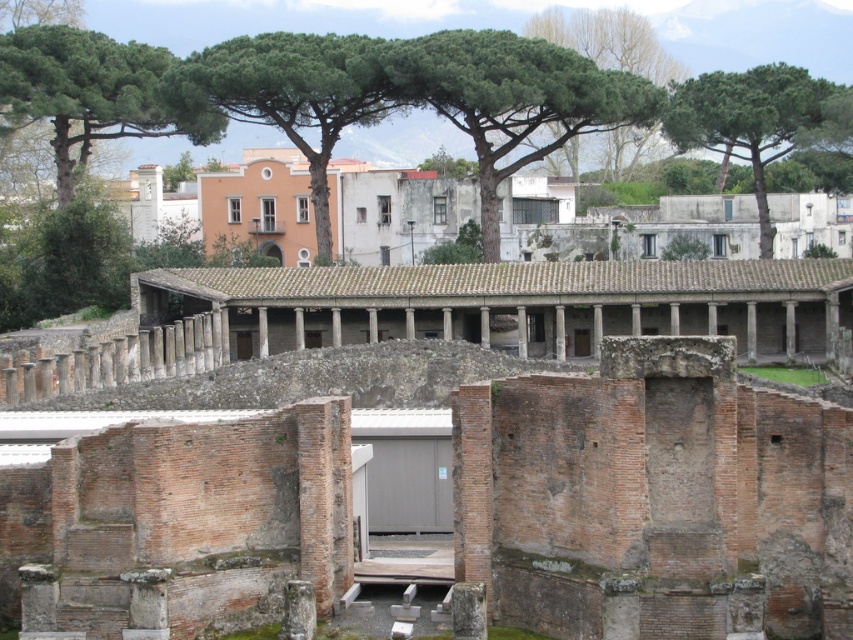
Question: Does brown stone amphitheater at center have a lesser width compared to green leafy tree at upper left?

Choices:
 (A) no
 (B) yes

Answer: (A)

Question: Considering the real-world distances, which object is farthest from the brown stone amphitheater at center?

Choices:
 (A) green leafy tree at upper right
 (B) brick wall at center
 (C) green leafy tree at upper center
 (D) green leafy tree at center

Answer: (B)

Question: Is the position of green leafy tree at upper left less distant than that of green leafy tree at upper right?

Choices:
 (A) yes
 (B) no

Answer: (A)

Question: Which of the following is the farthest from the observer?

Choices:
 (A) brown stone amphitheater at center
 (B) green leafy tree at upper left
 (C) green leafy tree at upper right

Answer: (C)

Question: Which is farther from the green leafy tree at upper center?

Choices:
 (A) green leafy tree at upper left
 (B) green leafy tree at upper right

Answer: (A)

Question: In this image, where is brick wall at center located relative to green leafy tree at upper center?

Choices:
 (A) above
 (B) below

Answer: (B)